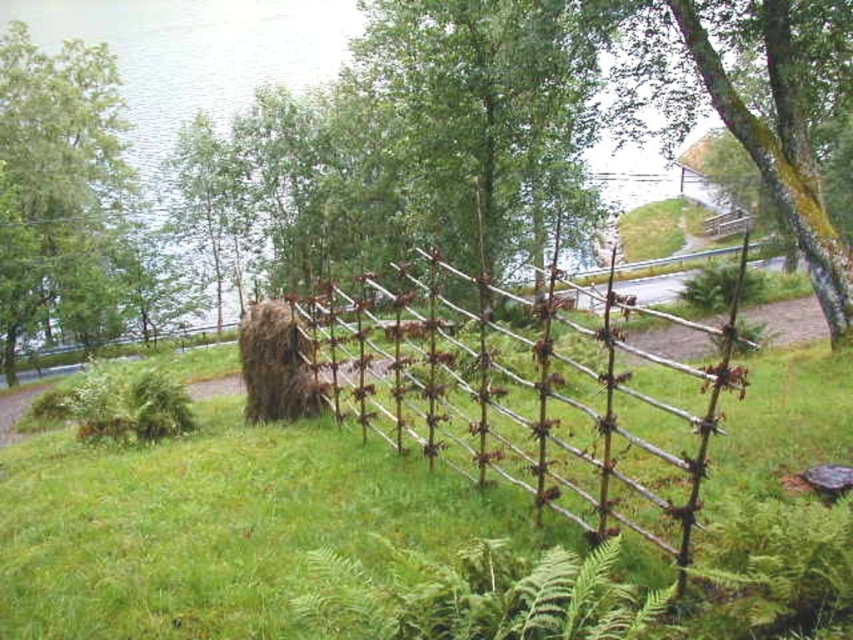
You are standing at the entrance of the path and see the green grassy at center and the green leafy tree at upper left. Which object is located to the right of the other?

The green grassy at center is to the right of the green leafy tree at upper left.

You are a gardener who needs to mow the lawn. You are currently standing at the green grassy at center. The brown wooden fence at center is in your way. Can you move around it to access the rest of the lawn?

The green grassy at center and brown wooden fence at center are 7.09 meters apart from each other. Since the distance between them is significant, you can easily move around the brown wooden fence at center to access the rest of the lawn.